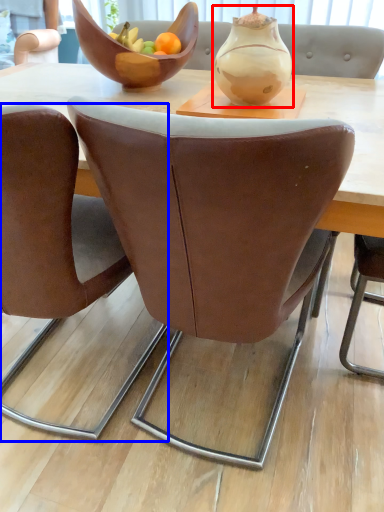
Question: Which object appears closest to the camera in this image, vase (highlighted by a red box) or chair (highlighted by a blue box)?

Choices:
 (A) vase
 (B) chair

Answer: (B)